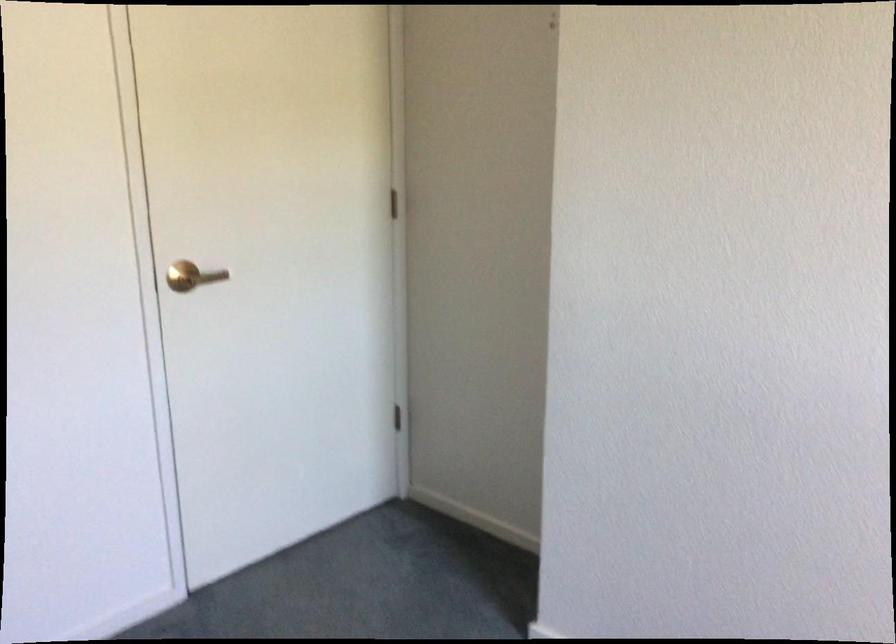
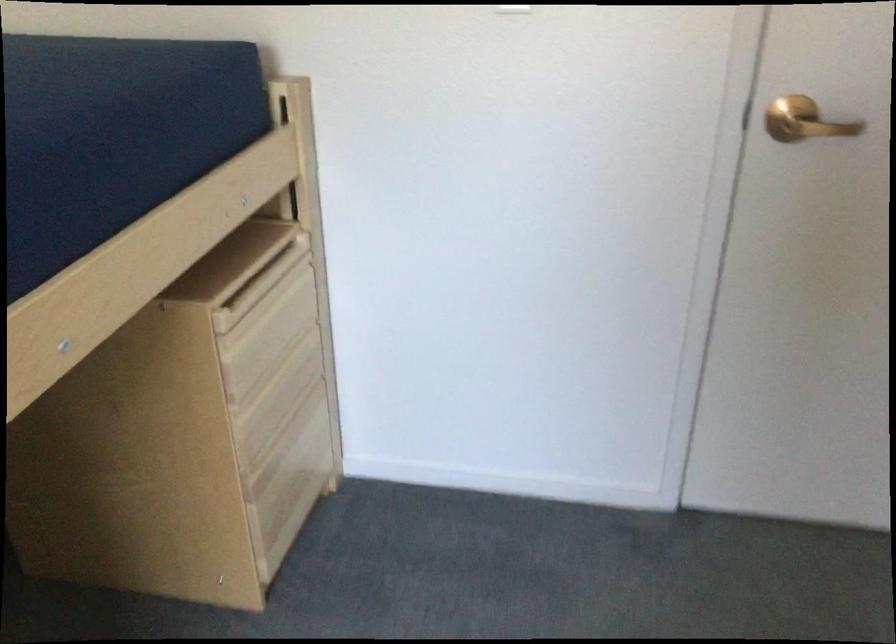
First-person continuous shooting, in which direction is the camera rotating?

The camera's rotation is toward left-down.